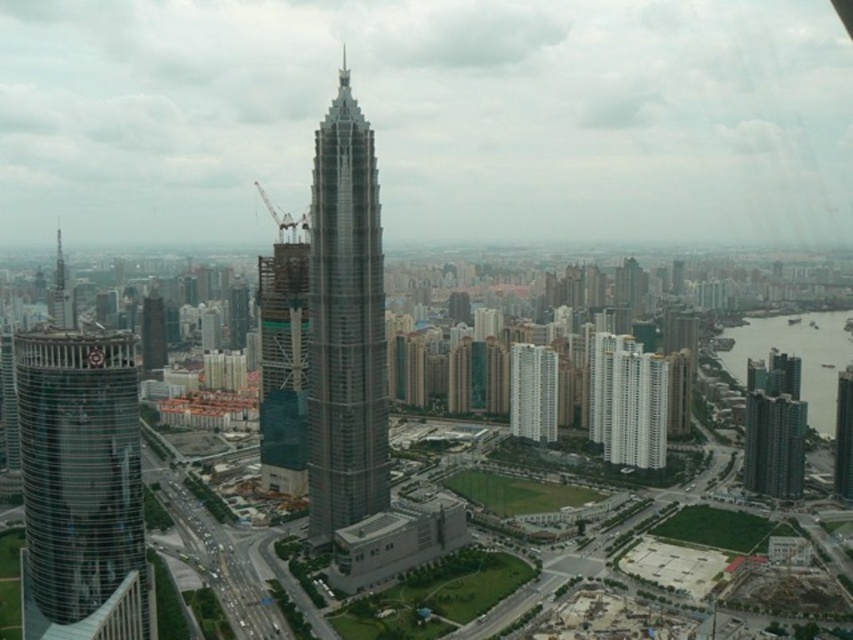
Question: Considering the relative positions of dark gray glass building at right and shiny glass tower at left in the image provided, where is dark gray glass building at right located with respect to shiny glass tower at left?

Choices:
 (A) below
 (B) above

Answer: (A)

Question: Considering the real-world distances, which object is closest to the glassy metallic skyscraper at center?

Choices:
 (A) shiny glass tower at left
 (B) white glass building at center

Answer: (B)

Question: Can you confirm if transparent glass tower at left is wider than glassy reflective skyscraper at left?

Choices:
 (A) yes
 (B) no

Answer: (B)

Question: Among these points, which one is farthest from the camera?

Choices:
 (A) (144, 353)
 (B) (55, 253)
 (C) (834, 428)
 (D) (294, 371)

Answer: (B)

Question: Does glassy reflective skyscraper at center appear on the right side of glassy reflective skyscraper at left?

Choices:
 (A) yes
 (B) no

Answer: (A)

Question: Which of the following is the farthest from the observer?

Choices:
 (A) white glass building at center
 (B) transparent glass tower at left
 (C) shiny glass skyscraper at center
 (D) glassy reflective skyscraper at left

Answer: (D)